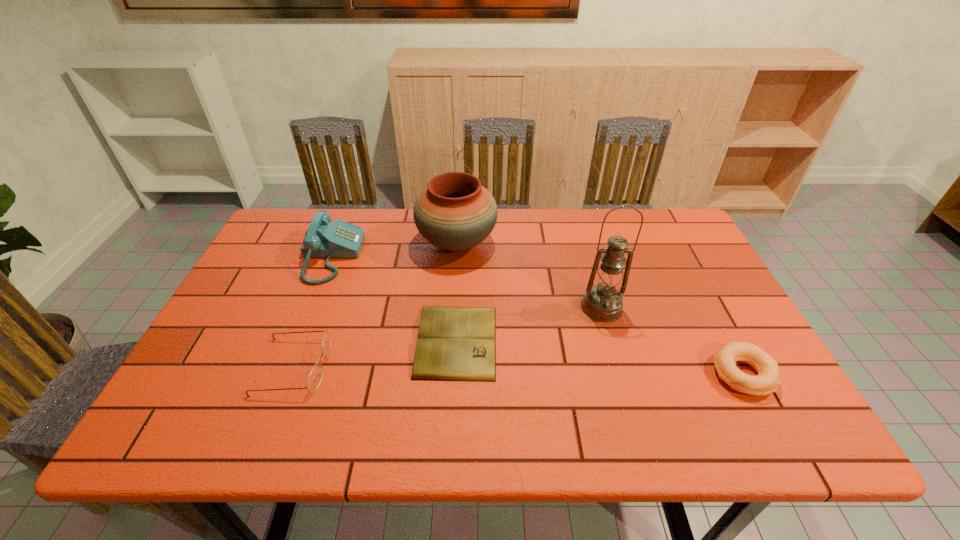
I want to click on free spot between the spectacles and the pottery, so click(x=375, y=305).

This screenshot has height=540, width=960. I want to click on free area in between the spectacles and the book, so click(x=375, y=354).

At what (x,y) coordinates should I click in order to perform the action: click on free space between the telephone and the spectacles. Please return your answer as a coordinate pair (x, y). The image size is (960, 540). Looking at the image, I should click on (313, 312).

This screenshot has height=540, width=960. What are the coordinates of `free space between the rightmost object and the spectacles` in the screenshot? It's located at (518, 370).

Locate an element on the screen. blank region between the pottery and the fourth shortest object is located at coordinates (395, 249).

Find the location of `empty location between the telephone and the oil lamp`. empty location between the telephone and the oil lamp is located at coordinates (467, 282).

You are a GUI agent. You are given a task and a screenshot of the screen. Output one action in this format:
    pyautogui.click(x=<x>, y=<y>)
    Task: Click on the object that is the fourth nearest to the third tallest object
    Image resolution: width=960 pixels, height=540 pixels.
    Given the screenshot: What is the action you would take?
    pyautogui.click(x=603, y=302)

What are the coordinates of `object that is the closest to the telephone` in the screenshot? It's located at (455, 212).

In order to click on free spot that satisfies the following two spatial constraints: 1. on the front side of the oil lamp; 2. on the front-facing side of the spectacles in this screenshot , I will do `click(618, 367)`.

Where is `free location that satisfies the following two spatial constraints: 1. on the back side of the rightmost object; 2. on the dial of the third tallest object`? free location that satisfies the following two spatial constraints: 1. on the back side of the rightmost object; 2. on the dial of the third tallest object is located at coordinates (680, 256).